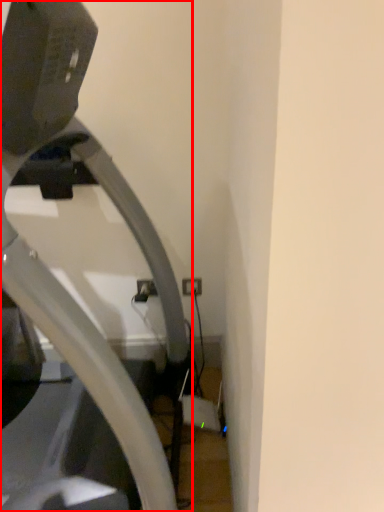
Question: From the image's perspective, where is treadmill (annotated by the red box) located relative to electric outlet?

Choices:
 (A) below
 (B) above

Answer: (B)